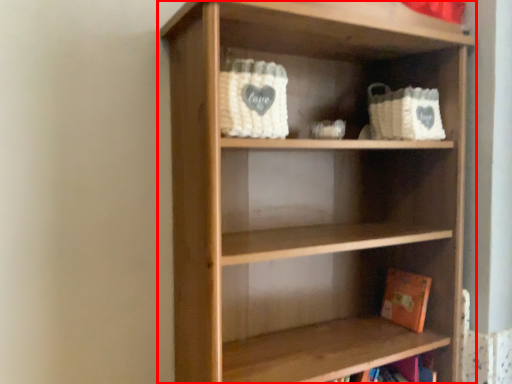
Question: From the image's perspective, where is shelf (annotated by the red box) located in relation to book in the image?

Choices:
 (A) above
 (B) below

Answer: (A)